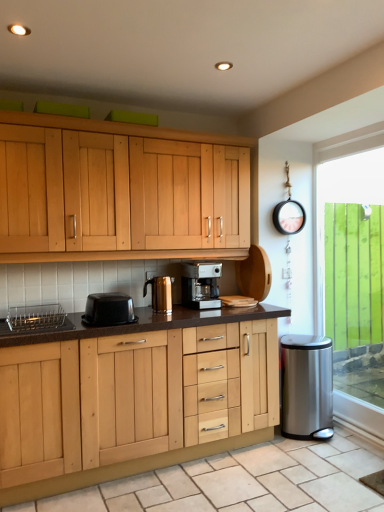
Question: Considering the relative sizes of stainless steel trash can at right, placed as the second appliance when sorted from top to bottom, and green glass window at right in the image provided, is stainless steel trash can at right, placed as the second appliance when sorted from top to bottom, wider than green glass window at right?

Choices:
 (A) yes
 (B) no

Answer: (A)

Question: Does stainless steel trash can at right, which is the 2th appliance from left to right, turn towards green glass window at right?

Choices:
 (A) no
 (B) yes

Answer: (A)

Question: Is stainless steel trash can at right, marked as the 1th appliance in a back-to-front arrangement, next to green glass window at right and touching it?

Choices:
 (A) no
 (B) yes

Answer: (A)

Question: Does stainless steel trash can at right, positioned as the 1th appliance in right-to-left order, have a smaller size compared to green glass window at right?

Choices:
 (A) no
 (B) yes

Answer: (B)

Question: Is stainless steel trash can at right, placed as the second appliance when sorted from top to bottom, positioned with its back to green glass window at right?

Choices:
 (A) no
 (B) yes

Answer: (A)

Question: From the image's perspective, is stainless steel trash can at right, which is counted as the 1th appliance, starting from the bottom, located above green glass window at right?

Choices:
 (A) yes
 (B) no

Answer: (B)

Question: Is satin silver coffee maker at center not inside beige tile at lower center?

Choices:
 (A) no
 (B) yes

Answer: (B)

Question: Is satin silver coffee maker at center further to the viewer compared to beige tile at lower center?

Choices:
 (A) yes
 (B) no

Answer: (A)

Question: Does satin silver coffee maker at center have a greater width compared to beige tile at lower center?

Choices:
 (A) yes
 (B) no

Answer: (B)

Question: Is the surface of satin silver coffee maker at center in direct contact with beige tile at lower center?

Choices:
 (A) yes
 (B) no

Answer: (B)

Question: Can you confirm if satin silver coffee maker at center is positioned to the right of beige tile at lower center?

Choices:
 (A) yes
 (B) no

Answer: (B)

Question: From a real-world perspective, is satin silver coffee maker at center physically below beige tile at lower center?

Choices:
 (A) yes
 (B) no

Answer: (B)

Question: Is black plastic container at center, which ranks as the first kitchen appliance in front-to-back order, smaller than metallic silver kettle at center, which appears as the first kitchen appliance when viewed from the back?

Choices:
 (A) no
 (B) yes

Answer: (A)